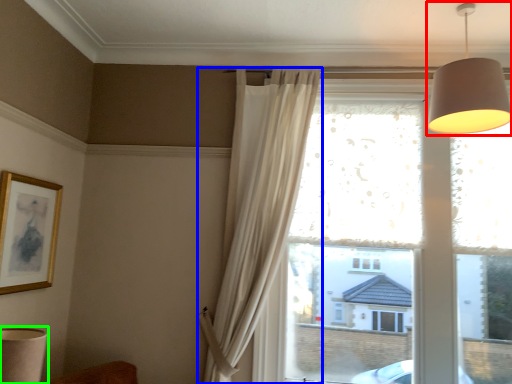
Question: Which object is positioned closest to lamp (highlighted by a red box)? Select from curtain (highlighted by a blue box) and table lamp (highlighted by a green box).

Choices:
 (A) curtain
 (B) table lamp

Answer: (A)